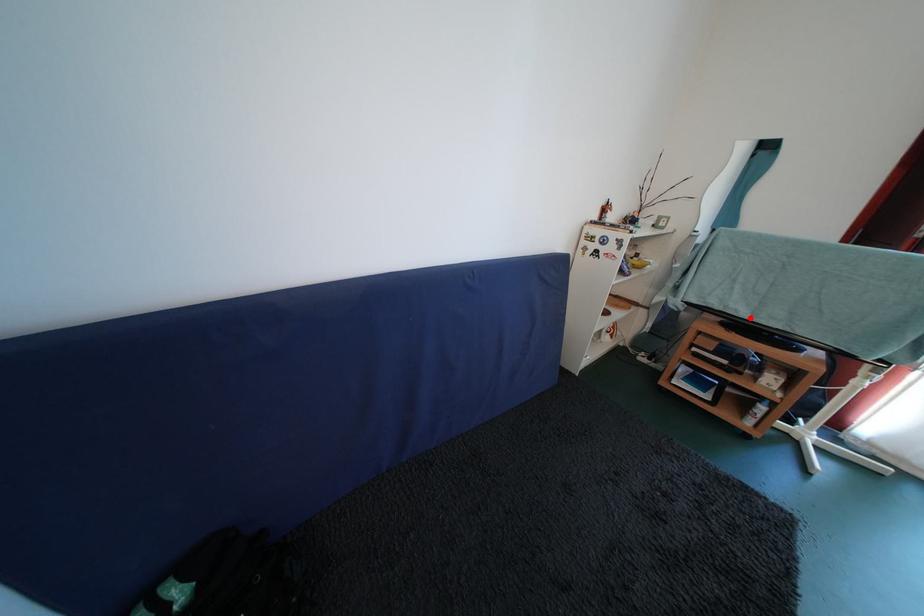
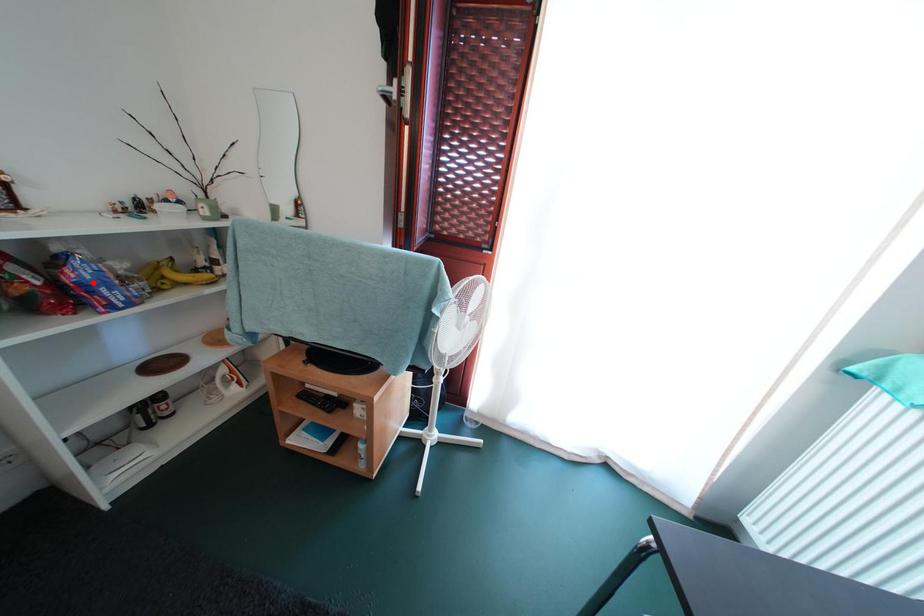
I am providing you with two images of the same scene from different viewpoints. A red point is marked on the first image and another point is marked on the second image. Is the red point in image1 aligned with the point shown in image2?

No